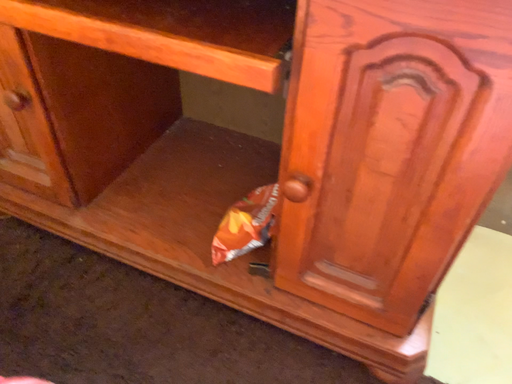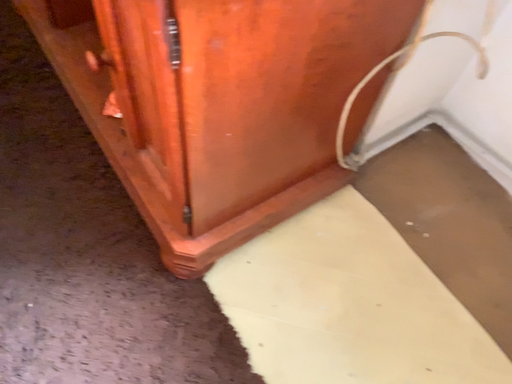
Question: How did the camera likely rotate when shooting the video?

Choices:
 (A) rotated downward
 (B) rotated upward

Answer: (A)